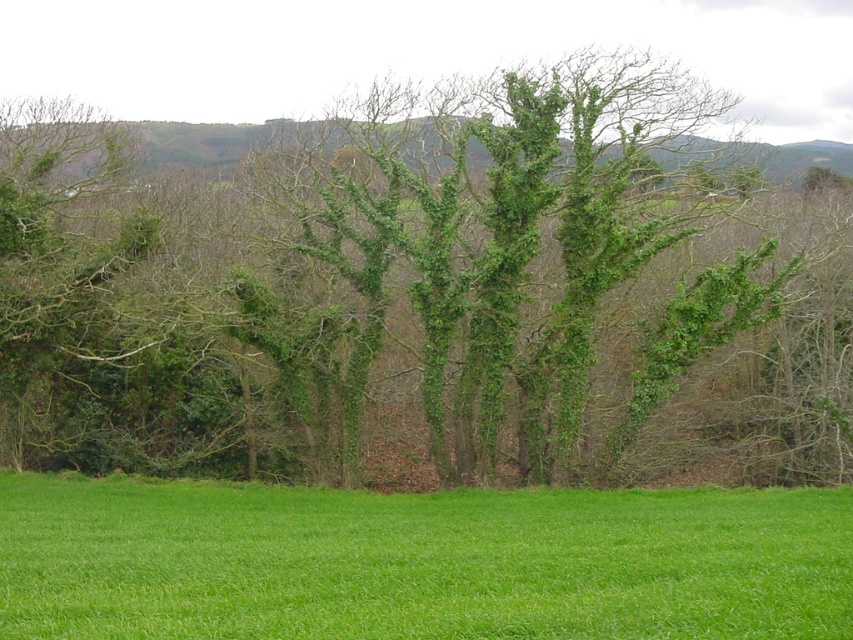
Which is more to the right, green leafy tree at center or green leafy hillside at upper center?

Positioned to the right is green leafy tree at center.

Is point (782, 253) in front of point (839, 145)?

Yes, it is.

Where is `green leafy tree at center`? The image size is (853, 640). green leafy tree at center is located at coordinates (428, 292).

Can you confirm if green leafy tree at center is positioned to the left of green grass at center?

Incorrect, green leafy tree at center is not on the left side of green grass at center.

Does green leafy tree at center appear on the right side of green grass at center?

Indeed, green leafy tree at center is positioned on the right side of green grass at center.

Between point (717, 192) and point (335, 595), which one is positioned in front?

Point (335, 595)

Where is `green leafy tree at center`? The image size is (853, 640). green leafy tree at center is located at coordinates (428, 292).

Between green grass at center and green leafy hillside at upper center, which one is positioned lower?

green grass at center is below.

Identify the location of green grass at center. (419, 561).